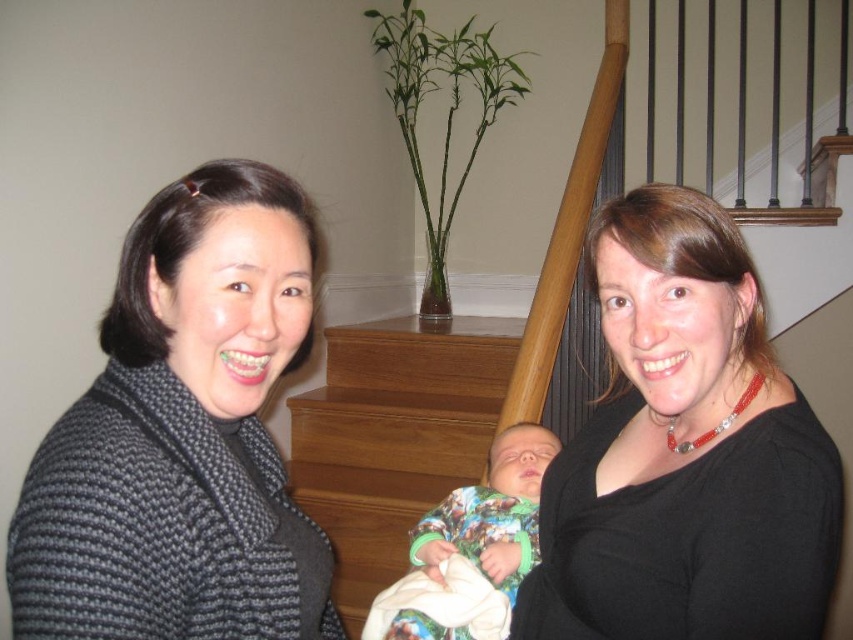
Locate an element on the screen. Image resolution: width=853 pixels, height=640 pixels. knitted gray sweater at left is located at coordinates (183, 436).

Which is behind, point (309, 336) or point (409, 460)?

The point (409, 460) is behind.

What do you see at coordinates (183, 436) in the screenshot? Image resolution: width=853 pixels, height=640 pixels. I see `knitted gray sweater at left` at bounding box center [183, 436].

Locate an element on the screen. Image resolution: width=853 pixels, height=640 pixels. knitted gray sweater at left is located at coordinates (183, 436).

In the scene shown: Who is more distant from viewer, (190, 563) or (653, 310)?

Positioned behind is point (653, 310).

Who is lower down, knitted gray sweater at left or black matte shirt at right?

black matte shirt at right

Which is behind, point (283, 579) or point (764, 580)?

Point (283, 579)

Locate an element on the screen. knitted gray sweater at left is located at coordinates (183, 436).

Does black matte shirt at right have a greater width compared to wooden stairs at center?

In fact, black matte shirt at right might be narrower than wooden stairs at center.

Between black matte shirt at right and wooden stairs at center, which one has less height?

With less height is black matte shirt at right.

Does point (585, 573) come farther from viewer compared to point (440, 365)?

That is False.

I want to click on black matte shirt at right, so click(685, 452).